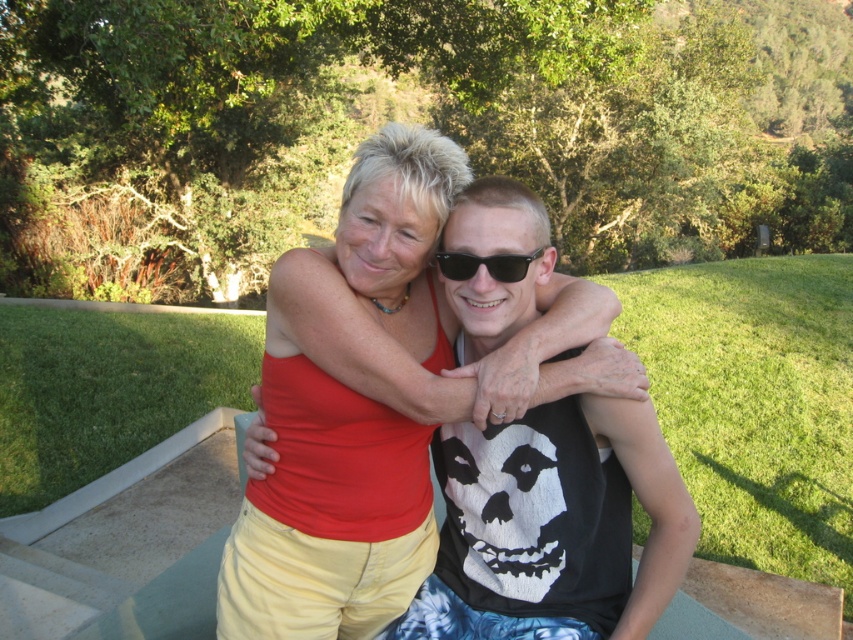
Question: Does matte red tank top at center come behind black plastic sunglasses at center?

Choices:
 (A) yes
 (B) no

Answer: (B)

Question: Which of the following is the farthest from the observer?

Choices:
 (A) matte red tank top at center
 (B) black plastic sunglasses at center

Answer: (B)

Question: Which object is farther from the camera taking this photo?

Choices:
 (A) matte red tank top at center
 (B) black plastic sunglasses at center

Answer: (B)

Question: Which object appears closest to the camera in this image?

Choices:
 (A) matte red tank top at center
 (B) black plastic sunglasses at center

Answer: (A)

Question: Is matte red tank top at center closer to the viewer compared to black plastic sunglasses at center?

Choices:
 (A) no
 (B) yes

Answer: (B)

Question: Can you confirm if matte red tank top at center is positioned to the left of black plastic sunglasses at center?

Choices:
 (A) no
 (B) yes

Answer: (B)